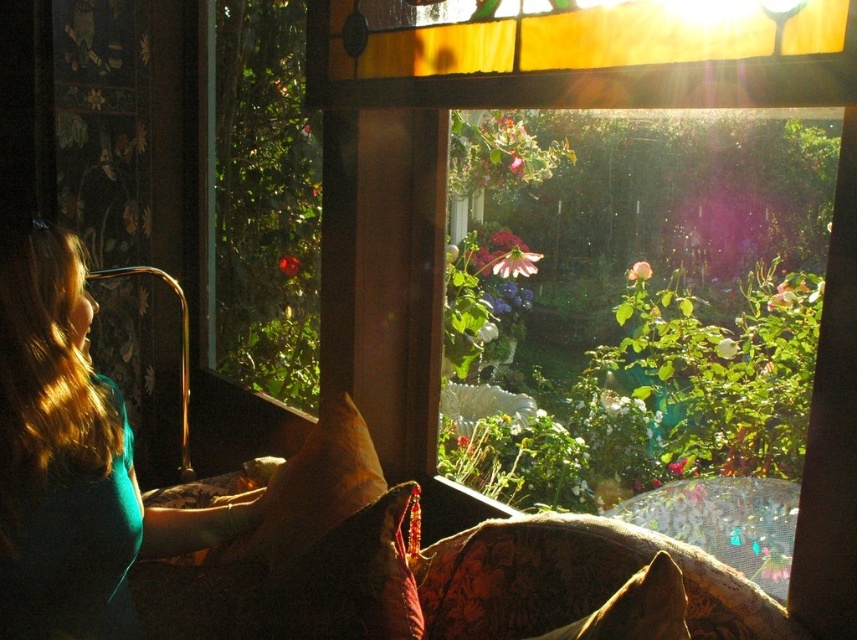
Question: Among these objects, which one is farthest from the camera?

Choices:
 (A) velvet brown pillow at lower center
 (B) brown textured pillow at lower center
 (C) green leafy plant at upper left

Answer: (C)

Question: Can you confirm if velvet floral couch at lower center is smaller than velvet brown pillow at lower center?

Choices:
 (A) yes
 (B) no

Answer: (B)

Question: Considering the real-world distances, which object is farthest from the transparent glass window at upper center?

Choices:
 (A) teal fabric shirt at left
 (B) brown textured pillow at lower center
 (C) suede-like tan pillow at center
 (D) velvet floral couch at lower center

Answer: (B)

Question: Which object is the closest to the transparent glass window at upper center?

Choices:
 (A) green leafy plant at upper left
 (B) brown textured pillow at lower center
 (C) velvet floral couch at lower center
 (D) velvet brown pillow at lower center

Answer: (A)

Question: Can you confirm if teal fabric shirt at left is positioned to the left of brown textured pillow at lower center?

Choices:
 (A) no
 (B) yes

Answer: (B)

Question: Is teal fabric shirt at left to the left of velvet floral couch at lower center from the viewer's perspective?

Choices:
 (A) no
 (B) yes

Answer: (B)